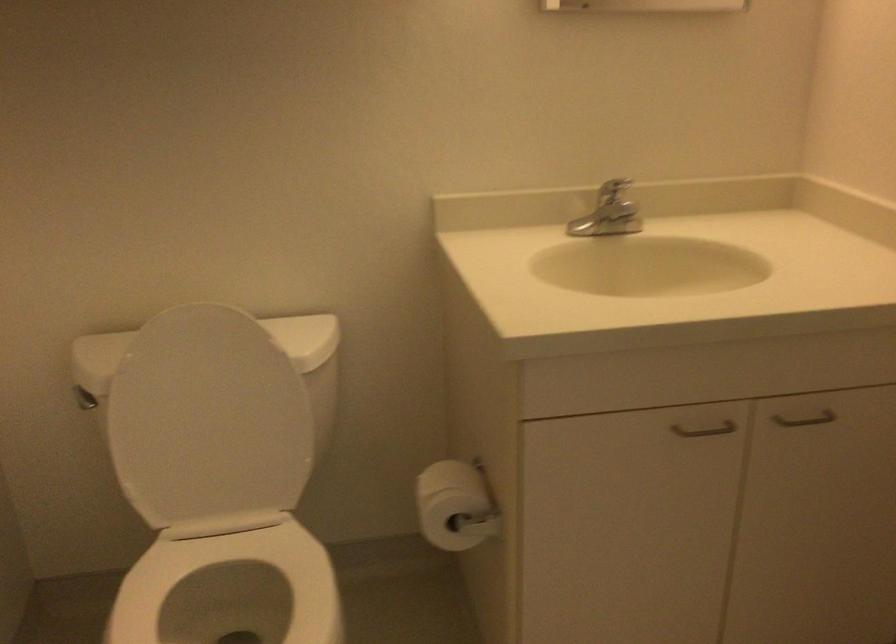
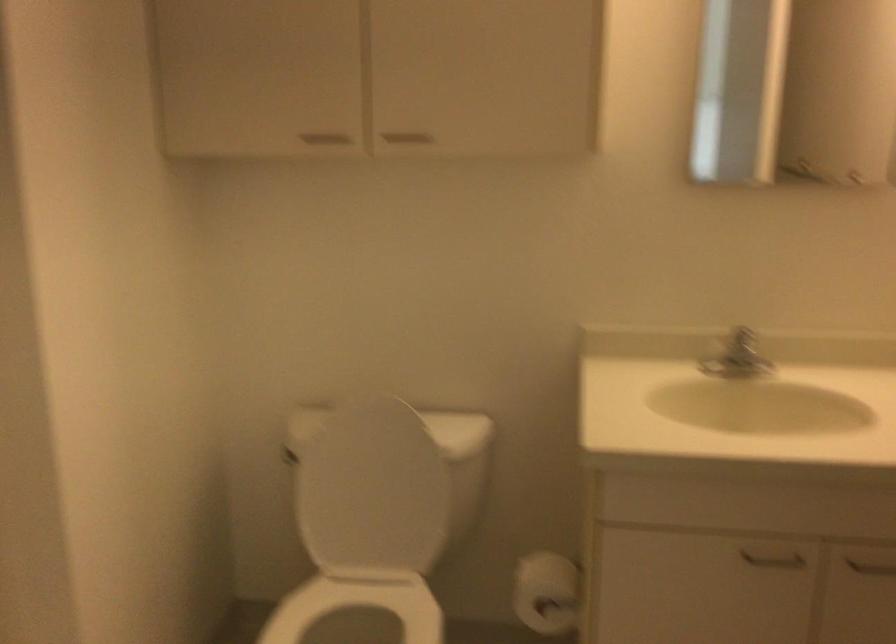
The point at (699,424) is marked in the first image. Where is the corresponding point in the second image?

(771, 558)